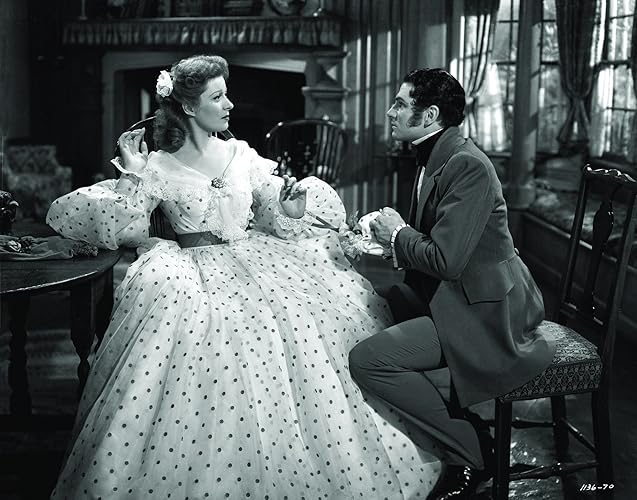
Where is `curtain`? Image resolution: width=637 pixels, height=500 pixels. curtain is located at coordinates (567, 82).